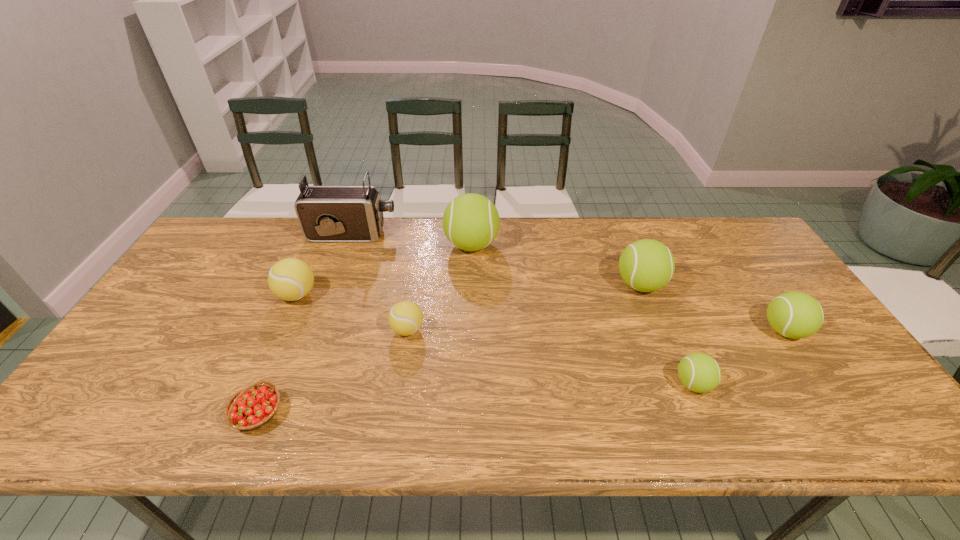
The width and height of the screenshot is (960, 540). I want to click on camcorder, so click(x=325, y=213).

Locate an element on the screen. The image size is (960, 540). the farthest green tennis ball is located at coordinates (471, 222).

Find the location of a particular element. The height and width of the screenshot is (540, 960). the third tennis ball from left to right is located at coordinates tap(471, 222).

Where is `the sixth shortest object`? This screenshot has width=960, height=540. the sixth shortest object is located at coordinates (646, 265).

Locate an element on the screen. This screenshot has height=540, width=960. the second biggest green tennis ball is located at coordinates (646, 265).

Where is `the rightmost green tennis ball`? This screenshot has width=960, height=540. the rightmost green tennis ball is located at coordinates (796, 315).

You are a GUI agent. You are given a task and a screenshot of the screen. Output one action in this format:
    pyautogui.click(x=<x>, y=<y>)
    Task: Click on the rightmost tennis ball
    
    Given the screenshot: What is the action you would take?
    pyautogui.click(x=796, y=315)

You are a GUI agent. You are given a task and a screenshot of the screen. Output one action in this format:
    pyautogui.click(x=<x>, y=<y>)
    Task: Click on the farther yellow tennis ball
    The width and height of the screenshot is (960, 540).
    Given the screenshot: What is the action you would take?
    pyautogui.click(x=290, y=279)

At what (x,y) coordinates should I click in order to perform the action: click on the leftmost tennis ball. Please return your answer as a coordinate pair (x, y). The width and height of the screenshot is (960, 540). Looking at the image, I should click on (290, 279).

Identify the location of the nearest tennis ball. (699, 372).